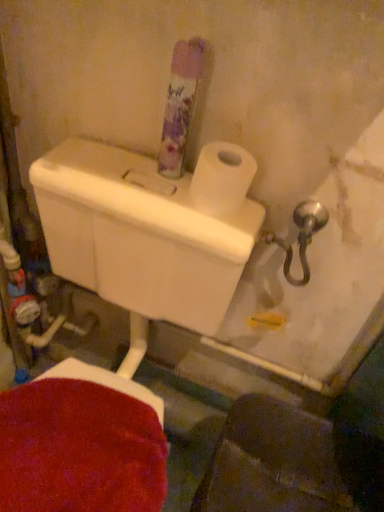
Question: Looking at their shapes, would you say translucent floral-patterned air freshener at upper center is wider or thinner than white matte toilet paper at upper right?

Choices:
 (A) thin
 (B) wide

Answer: (A)

Question: Considering the relative positions of translucent floral-patterned air freshener at upper center and white matte toilet paper at upper right in the image provided, is translucent floral-patterned air freshener at upper center to the left or to the right of white matte toilet paper at upper right?

Choices:
 (A) right
 (B) left

Answer: (B)

Question: From a real-world perspective, is translucent floral-patterned air freshener at upper center physically located above or below white matte toilet paper at upper right?

Choices:
 (A) above
 (B) below

Answer: (A)

Question: Visually, is white matte toilet paper at upper right positioned to the left or to the right of translucent floral-patterned air freshener at upper center?

Choices:
 (A) right
 (B) left

Answer: (A)

Question: From a real-world perspective, is white matte toilet paper at upper right physically located above or below translucent floral-patterned air freshener at upper center?

Choices:
 (A) below
 (B) above

Answer: (A)

Question: From the image's perspective, is white matte toilet paper at upper right located above or below translucent floral-patterned air freshener at upper center?

Choices:
 (A) below
 (B) above

Answer: (A)

Question: In the image, is white matte toilet paper at upper right positioned in front of or behind translucent floral-patterned air freshener at upper center?

Choices:
 (A) front
 (B) behind

Answer: (B)